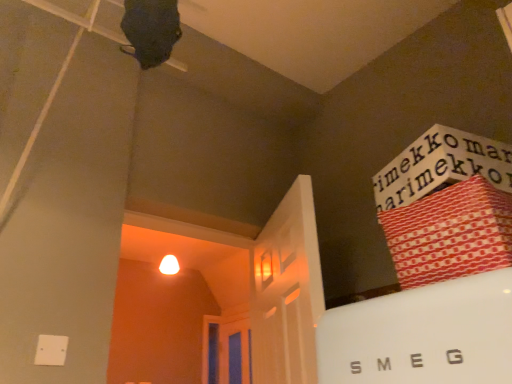
Identify the location of red paper bag at upper right. (450, 233).

What do you see at coordinates (450, 233) in the screenshot?
I see `red paper bag at upper right` at bounding box center [450, 233].

Image resolution: width=512 pixels, height=384 pixels. Find the location of `blue glass door at center`. blue glass door at center is located at coordinates (234, 353).

Image resolution: width=512 pixels, height=384 pixels. What do you see at coordinates (234, 353) in the screenshot? I see `blue glass door at center` at bounding box center [234, 353].

In order to click on red paper bag at upper right in this screenshot , I will do `click(450, 233)`.

Is blue glass door at center to the left or to the right of red paper bag at upper right in the image?

Clearly, blue glass door at center is on the left of red paper bag at upper right in the image.

Which object is more forward, blue glass door at center or red paper bag at upper right?

Positioned in front is red paper bag at upper right.

Considering the positions of point (223, 350) and point (470, 247), is point (223, 350) closer or farther from the camera than point (470, 247)?

Point (223, 350).

From the image's perspective, does blue glass door at center appear higher than red paper bag at upper right?

No, from the image's perspective, blue glass door at center is not on top of red paper bag at upper right.

From a real-world perspective, is blue glass door at center below red paper bag at upper right?

No.

Can you confirm if blue glass door at center is thinner than red paper bag at upper right?

Yes.

Considering the sizes of objects blue glass door at center and red paper bag at upper right in the image provided, who is taller, blue glass door at center or red paper bag at upper right?

With more height is blue glass door at center.

Based on their sizes in the image, would you say blue glass door at center is bigger or smaller than red paper bag at upper right?

blue glass door at center is bigger than red paper bag at upper right.

In the scene shown: Is blue glass door at center positioned beyond the bounds of red paper bag at upper right?

Yes, blue glass door at center is located beyond the bounds of red paper bag at upper right.

Is blue glass door at center with red paper bag at upper right?

No.

Is blue glass door at center turned away from red paper bag at upper right?

No, blue glass door at center's orientation is not away from red paper bag at upper right.

Where is `door below the red paper bag at upper right (from the image's perspective)`? door below the red paper bag at upper right (from the image's perspective) is located at coordinates (234, 353).

Is red paper bag at upper right at the left side of blue glass door at center?

Incorrect, red paper bag at upper right is not on the left side of blue glass door at center.

Consider the image. Which is in front, red paper bag at upper right or blue glass door at center?

Positioned in front is red paper bag at upper right.

Which is in front, point (411, 286) or point (247, 354)?

The point (411, 286) is more forward.

Looking at this image, from the image's perspective, which object appears higher, red paper bag at upper right or blue glass door at center?

From the image's view, red paper bag at upper right is above.

From a real-world perspective, between red paper bag at upper right and blue glass door at center, who is vertically lower?

red paper bag at upper right, from a real-world perspective.

Considering the sizes of red paper bag at upper right and blue glass door at center in the image, is red paper bag at upper right wider or thinner than blue glass door at center?

Considering their sizes, red paper bag at upper right looks broader than blue glass door at center.

Who is shorter, red paper bag at upper right or blue glass door at center?

red paper bag at upper right.

Which of these two, red paper bag at upper right or blue glass door at center, is smaller?

red paper bag at upper right is smaller.

Is red paper bag at upper right not within blue glass door at center?

That's correct, red paper bag at upper right is outside of blue glass door at center.

Is red paper bag at upper right directly adjacent to blue glass door at center?

No, red paper bag at upper right is not touching blue glass door at center.

Is red paper bag at upper right facing towards blue glass door at center?

No.

The image size is (512, 384). In order to click on bundle in front of the blue glass door at center in this screenshot , I will do pyautogui.click(x=450, y=233).

In order to click on door located below the red paper bag at upper right (from the image's perspective) in this screenshot , I will do `click(234, 353)`.

Identify the location of bundle above the blue glass door at center (from the image's perspective). (450, 233).